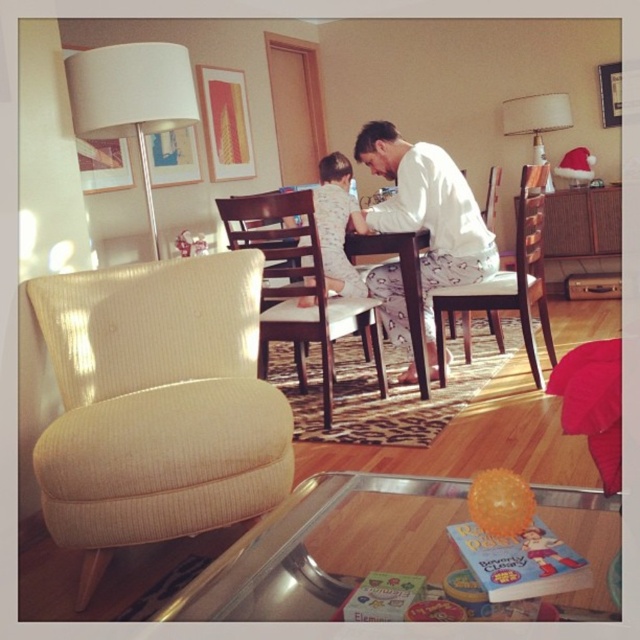
Question: Which object is positioned farthest from the white cotton shirt at center?

Choices:
 (A) beige textured armchair at left
 (B) white fabric armchair at center

Answer: (A)

Question: Does wooden chair at center lie behind white fabric armchair at center?

Choices:
 (A) no
 (B) yes

Answer: (A)

Question: Considering the real-world distances, which object is closest to the transparent glass table at lower center?

Choices:
 (A) white fabric armchair at center
 (B) wooden chair at center
 (C) white cotton shirt at center

Answer: (B)

Question: Where is transparent glass table at lower center located in relation to white cotton shirt at center in the image?

Choices:
 (A) left
 (B) right

Answer: (A)

Question: Which object is positioned farthest from the white fabric armchair at center?

Choices:
 (A) wooden chair at center
 (B) beige textured armchair at left
 (C) white cotton shirt at center
 (D) white pajama at center

Answer: (B)

Question: Does beige textured armchair at left have a larger size compared to white pajama at center?

Choices:
 (A) no
 (B) yes

Answer: (B)